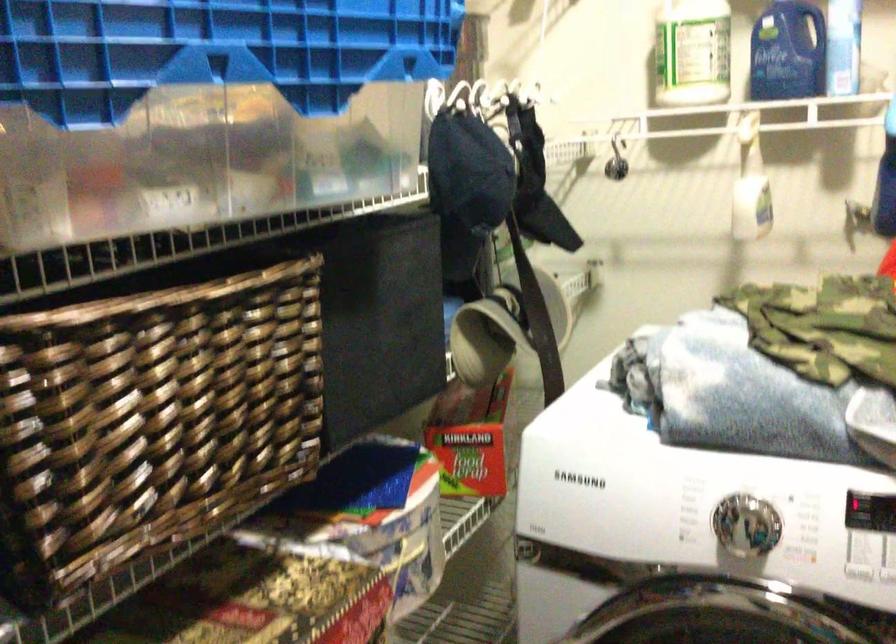
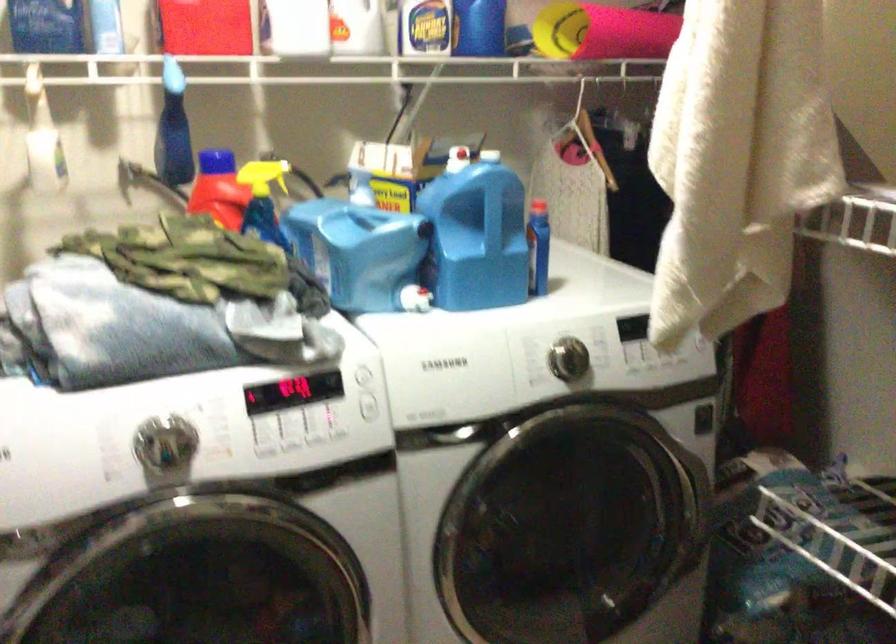
The point at (726, 531) is marked in the first image. Where is the corresponding point in the second image?

(166, 448)